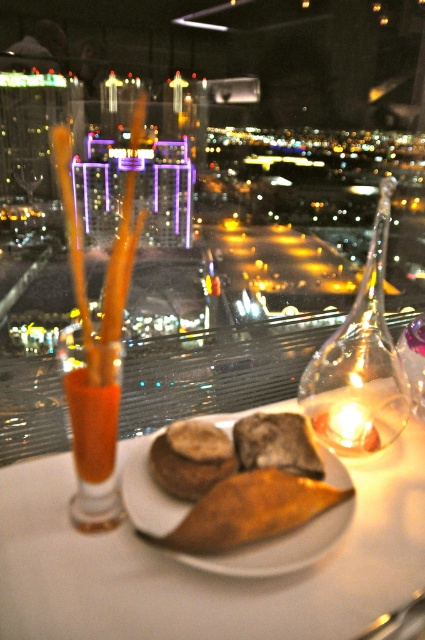
Question: Among these points, which one is farthest from the camera?

Choices:
 (A) (113, 433)
 (B) (379, 476)
 (C) (414, 337)
 (D) (220, 461)

Answer: (C)

Question: Can you confirm if brown crusty bread at center is wider than dark brown crusty bread at center?

Choices:
 (A) yes
 (B) no

Answer: (A)

Question: In this image, where is brown crusty bread at center located relative to dark brown crusty bread at center?

Choices:
 (A) left
 (B) right

Answer: (A)

Question: Can you confirm if transparent glass carafe at center is bigger than translucent orange liquid at left?

Choices:
 (A) yes
 (B) no

Answer: (A)

Question: Among these objects, which one is nearest to the camera?

Choices:
 (A) golden-brown crusty bread at center
 (B) transparent glass carafe at center
 (C) translucent orange drink at left

Answer: (A)

Question: Which point is farther to the camera?

Choices:
 (A) (416, 412)
 (B) (283, 451)
 (C) (96, 422)

Answer: (A)